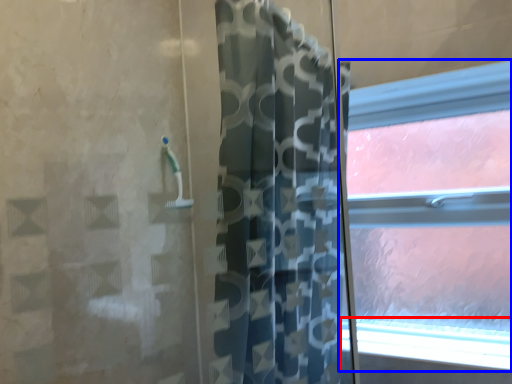
Question: Among these objects, which one is farthest to the camera, window sill (highlighted by a red box) or window (highlighted by a blue box)?

Choices:
 (A) window sill
 (B) window

Answer: (B)